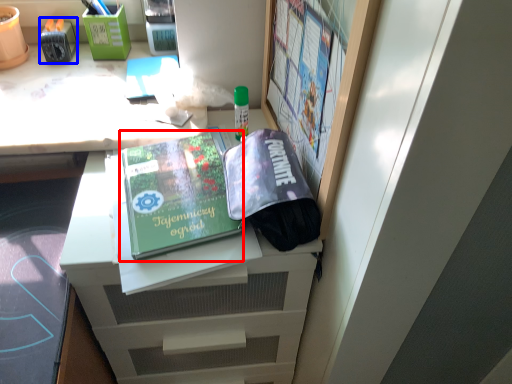
Question: Among these objects, which one is farthest to the camera, paperback book (highlighted by a red box) or stationery (highlighted by a blue box)?

Choices:
 (A) paperback book
 (B) stationery

Answer: (B)